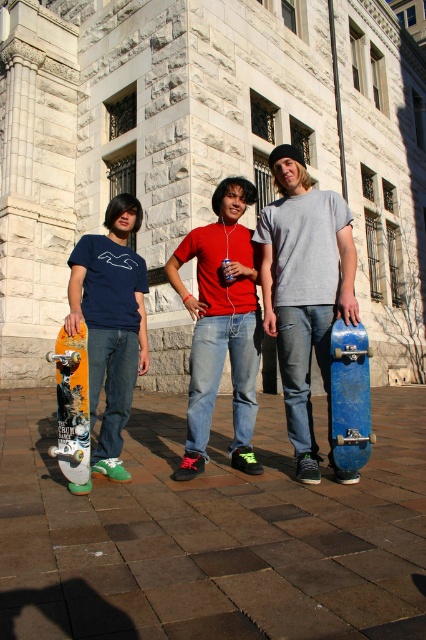
Question: Can you confirm if ripped denim jeans at center is bigger than blue matte skateboard at right?

Choices:
 (A) no
 (B) yes

Answer: (B)

Question: From the image, what is the correct spatial relationship of ripped denim jeans at center in relation to blue matte skateboard at right?

Choices:
 (A) left
 (B) right

Answer: (A)

Question: Which of the following is the closest to the observer?

Choices:
 (A) (169, 525)
 (B) (135, 296)
 (C) (360, 339)

Answer: (A)

Question: Which point appears closest to the camera in this image?

Choices:
 (A) (267, 620)
 (B) (210, 244)

Answer: (A)

Question: Is matte yellow skateboard at left wider than blue matte skateboard at right?

Choices:
 (A) yes
 (B) no

Answer: (A)

Question: Which object appears farthest from the camera in this image?

Choices:
 (A) blue matte skateboard at right
 (B) ripped denim jeans at center
 (C) orange matte skateboard at left
 (D) brown brick pavement at center

Answer: (D)